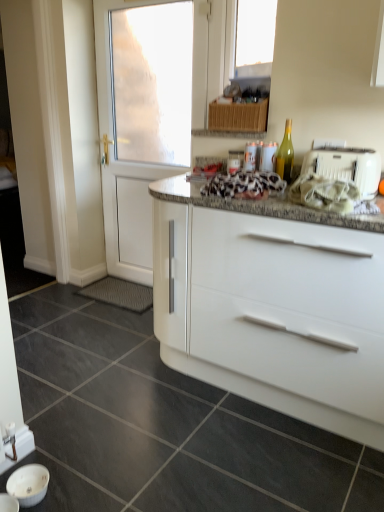
Find the location of `vacant area that is situated to the right of white glossy sink at lower left`. vacant area that is situated to the right of white glossy sink at lower left is located at coordinates (92, 484).